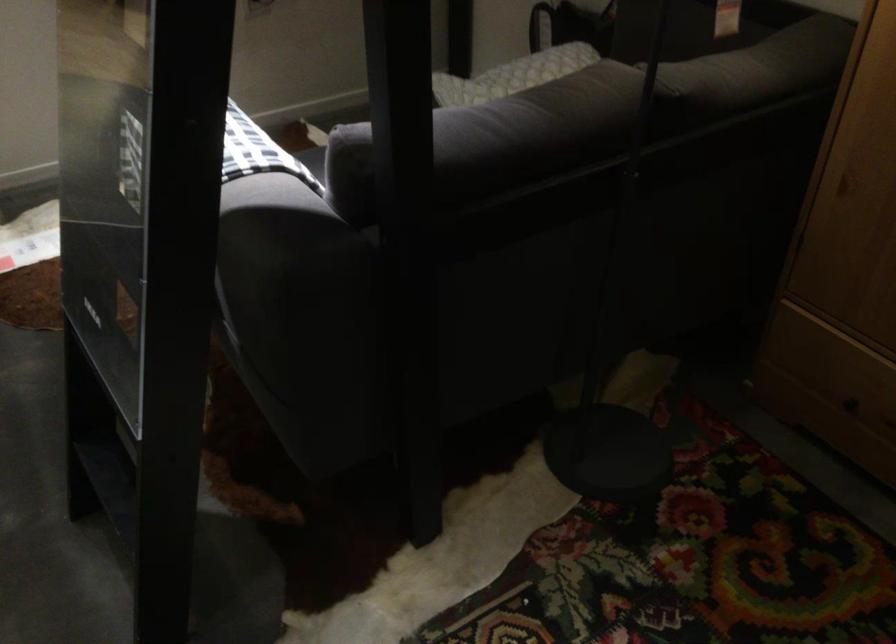
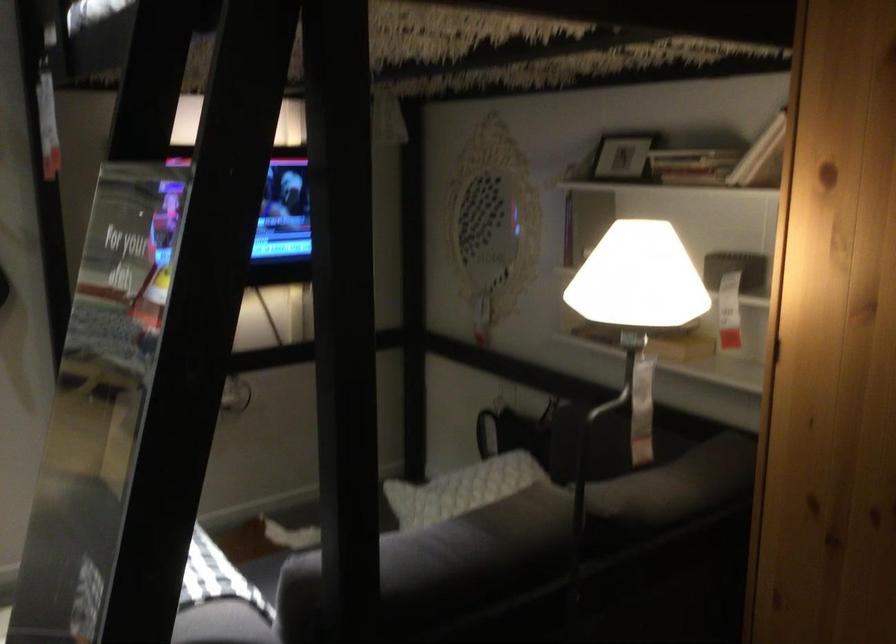
Question: Which direction would the cameraman need to move to produce the second image? Reply with the corresponding letter.

Choices:
 (A) Left
 (B) Right
 (C) Forward
 (D) Backward

Answer: (D)